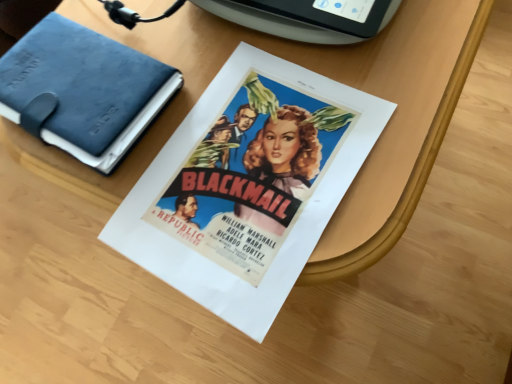
The height and width of the screenshot is (384, 512). In order to click on free location to the right of matte blue notebook at upper left in this screenshot , I will do (227, 77).